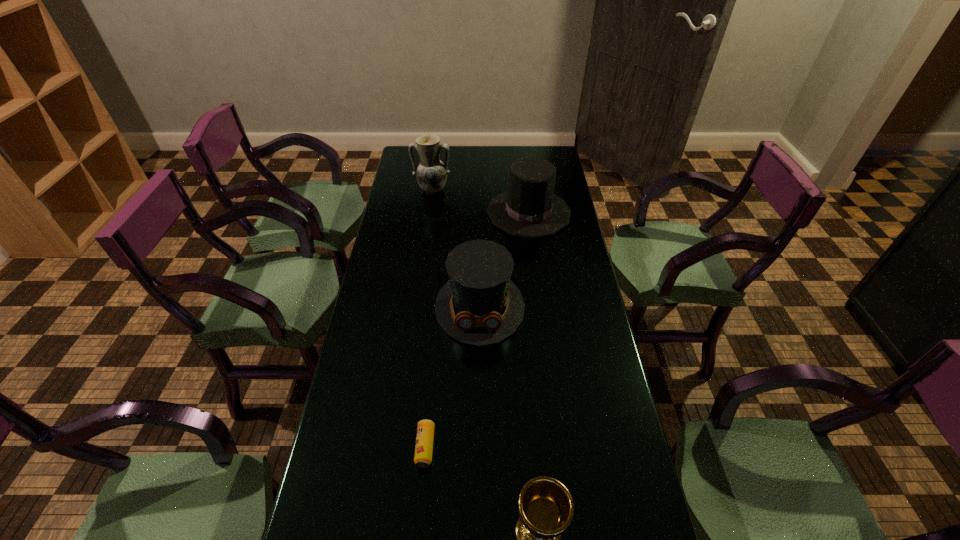
At what (x,y) coordinates should I click in order to perform the action: click on free space that satisfies the following two spatial constraints: 1. on either side of the shortest object; 2. on the right side of the pottery. Please return your answer as a coordinate pair (x, y). The width and height of the screenshot is (960, 540). Looking at the image, I should click on (398, 447).